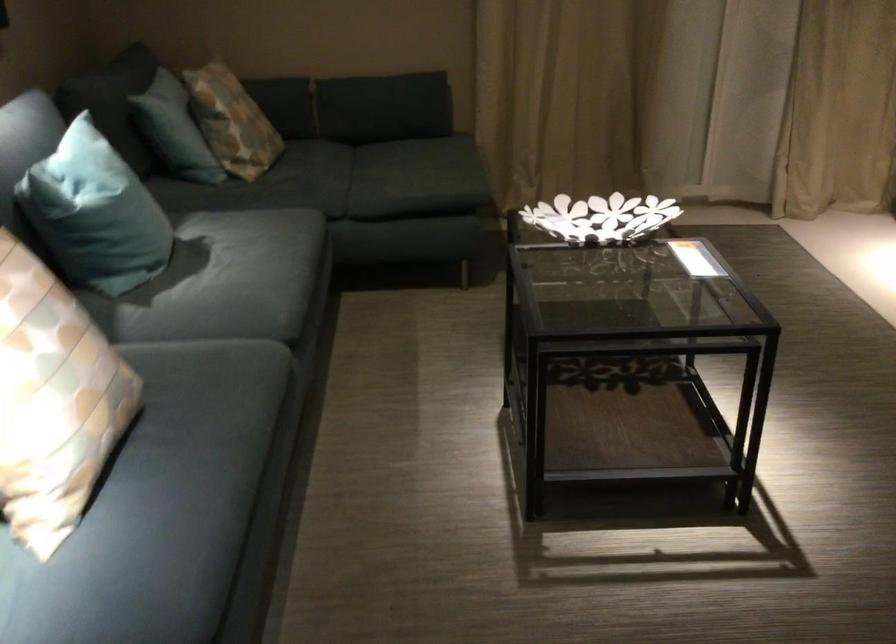
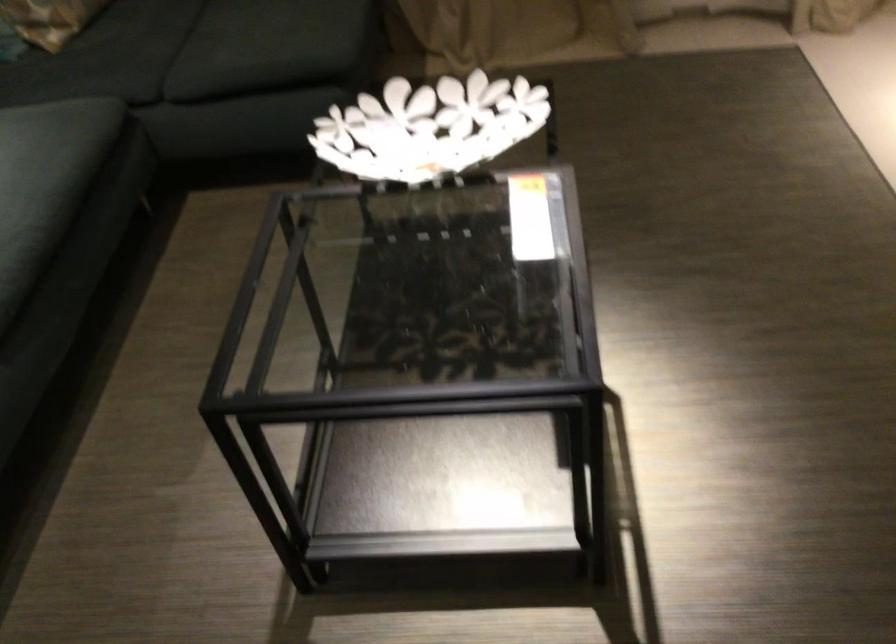
Locate, in the second image, the point that corresponds to point 288,194 in the first image.

(85, 73)